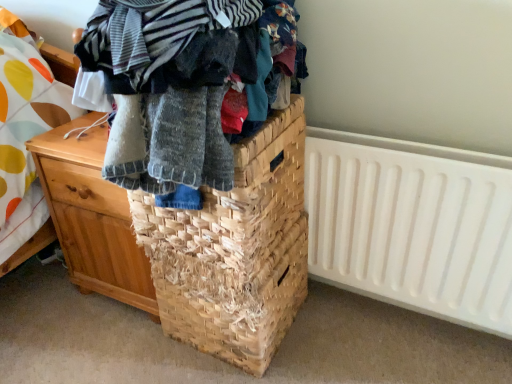
Where is `free spot below white plastic radiator at right (from a real-world perspective)`? The height and width of the screenshot is (384, 512). free spot below white plastic radiator at right (from a real-world perspective) is located at coordinates (396, 321).